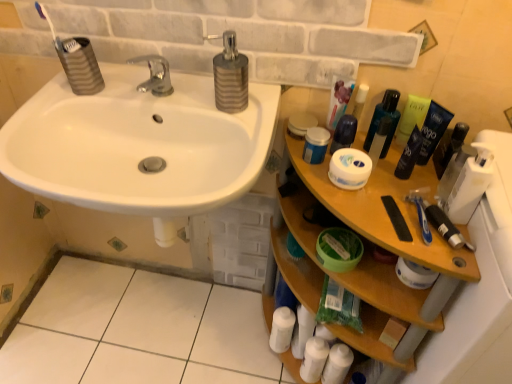
At what (x,y) coordinates should I click in order to perform the action: click on free space in front of green plastic bottle at upper right, the 3th mouthwash in the right-to-left sequence. Please return your answer as a coordinate pair (x, y). The width and height of the screenshot is (512, 384). Looking at the image, I should click on (400, 191).